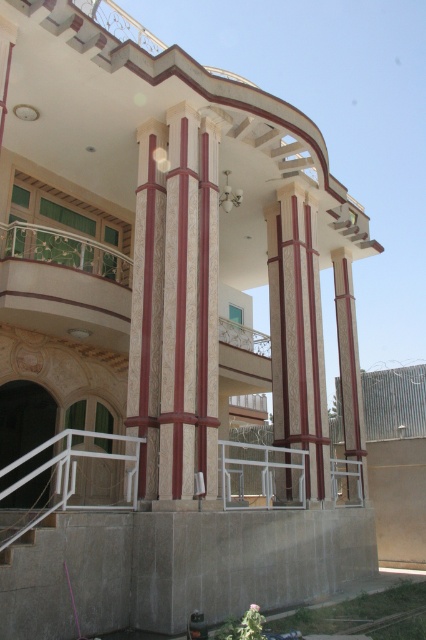
You are standing in front of the building and notice a point at coordinates (207, 308). What object is located at that point?

The point at coordinates (207, 308) corresponds to the smooth red wood pillar at center.

In the scene shown: You are an architect evaluating the structural integrity of the building. You need to determine if the maroon textured column at center can support the weight of the white concrete stairs at lower left. Based on their widths, what would you conclude?

The maroon textured column at center has a smaller width than the white concrete stairs at lower left. Since the column is narrower, it may not have sufficient structural capacity to support the stairs, raising concerns about its loadbearing capability.